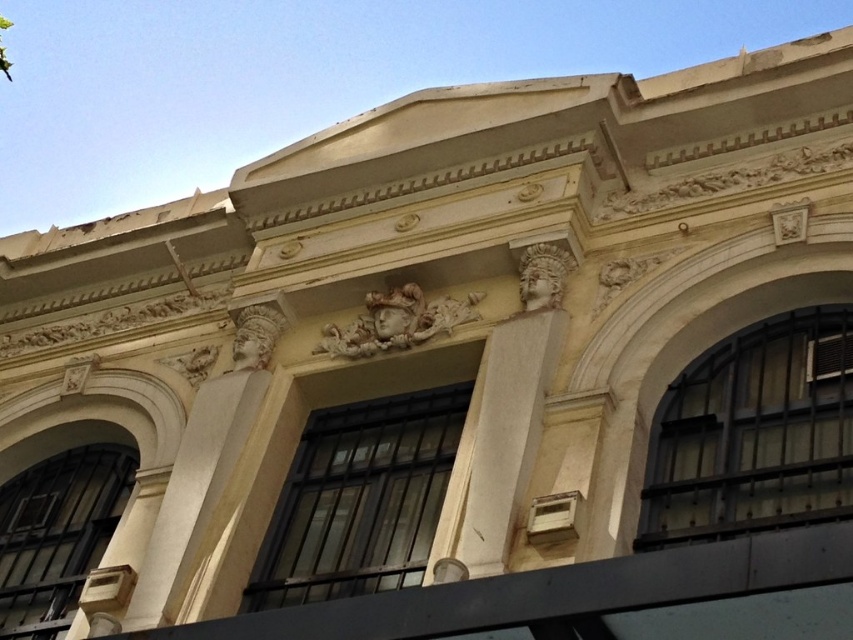
You are an architect examining the building facade. You notice two columns at the center, a white stone column at center and a white marble column at center. Which column has a greater width?

The white stone column at center has a greater width than the white marble column at center according to the description.

You are standing in front of the building and want to take a photo of the white stone column at center. If you move 0.1 units to the right along the x axis, will the column still be in the center of your photo?

The white stone column at center is located at point (500,442). Moving 0.1 units to the right would shift its position to approximately (500,506). Since the original position was at the center, moving it further right would mean it is no longer centered. Therefore, the column will not be in the center of your photo anymore.

You are an architect designing a new building inspired by classical architecture. You need to place a white marble column at center and a white stone column at center in such a way that they are aligned with the existing columns on the facade. Given their current distance apart, will they fit within the 14 meter spacing required by the design plan?

The white stone column at center and white marble column at center are 13.25 meters apart, which is within the 14 meter spacing requirement. Therefore, they will fit within the design plan.